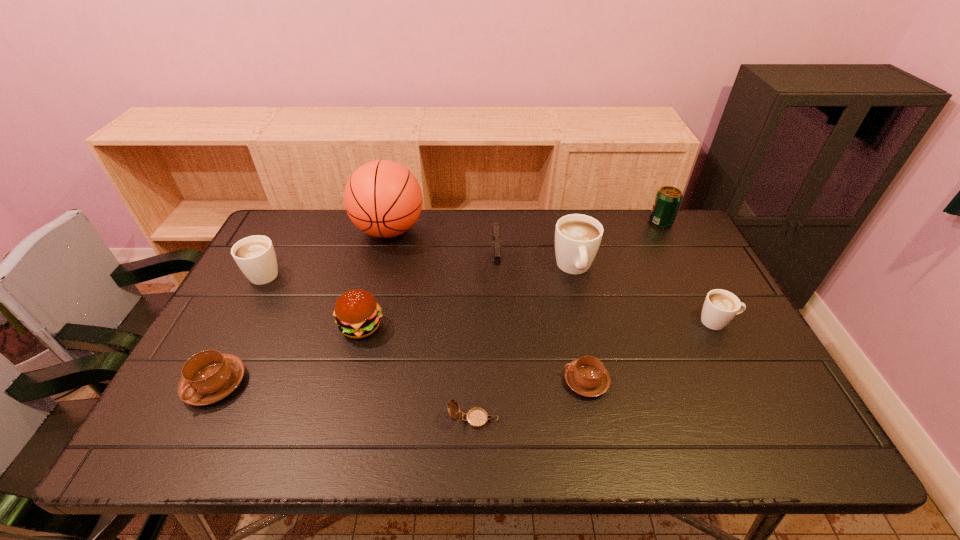
Locate which object is the sixth closest to the third nearest cappuccino. Please provide its 2D coordinates. Your answer should be formatted as a tuple, i.e. [(x, y)], where the tuple contains the x and y coordinates of a point satisfying the conditions above.

[(382, 198)]

In order to click on cappuccino that is the fourth nearest to the fourth shortest cappuccino in this screenshot , I will do `click(720, 306)`.

Identify the location of the fourth closest cappuccino relative to the green beer can. The image size is (960, 540). (255, 255).

Where is `white cappuccino object that ranks as the closest to the second white cappuccino from left to right`? white cappuccino object that ranks as the closest to the second white cappuccino from left to right is located at coordinates (720, 306).

Identify the location of white cappuccino that stands as the second closest to the second biggest white cappuccino. The height and width of the screenshot is (540, 960). (720, 306).